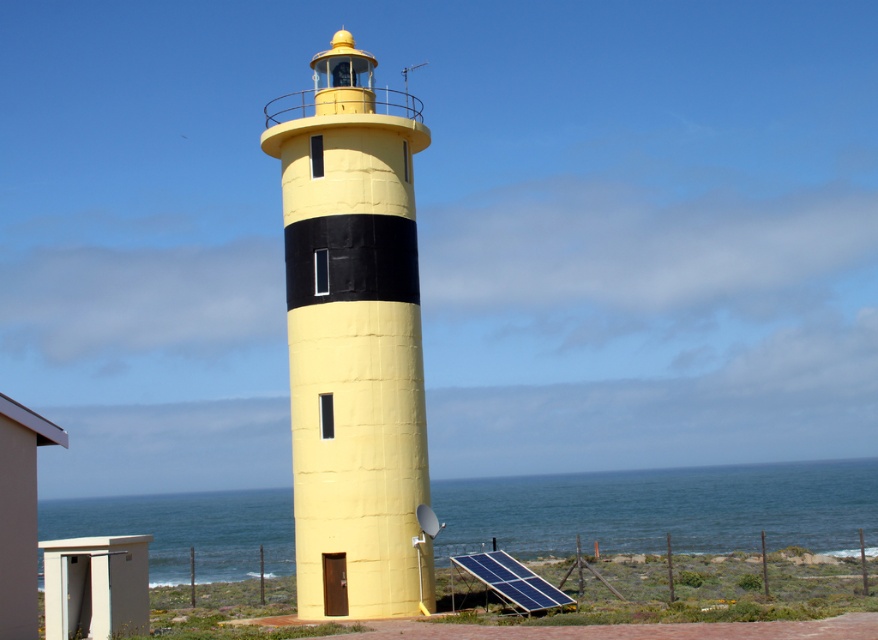
Question: Which point is closer to the camera?

Choices:
 (A) blue water at lower center
 (B) blue photovoltaic panel at lower right
 (C) yellow matte/lightweight tower at center

Answer: (A)

Question: Considering the relative positions of yellow matte/lightweight tower at center and blue photovoltaic panel at lower right in the image provided, where is yellow matte/lightweight tower at center located with respect to blue photovoltaic panel at lower right?

Choices:
 (A) left
 (B) right

Answer: (A)

Question: Which of the following is the farthest from the observer?

Choices:
 (A) yellow matte/lightweight tower at center
 (B) blue photovoltaic panel at lower right

Answer: (A)

Question: Can you confirm if yellow matte/lightweight tower at center is bigger than blue photovoltaic panel at lower right?

Choices:
 (A) no
 (B) yes

Answer: (B)

Question: Among these objects, which one is nearest to the camera?

Choices:
 (A) blue photovoltaic panel at lower right
 (B) blue water at lower center
 (C) yellow matte/lightweight tower at center

Answer: (B)

Question: Is blue water at lower center to the right of blue photovoltaic panel at lower right from the viewer's perspective?

Choices:
 (A) yes
 (B) no

Answer: (A)